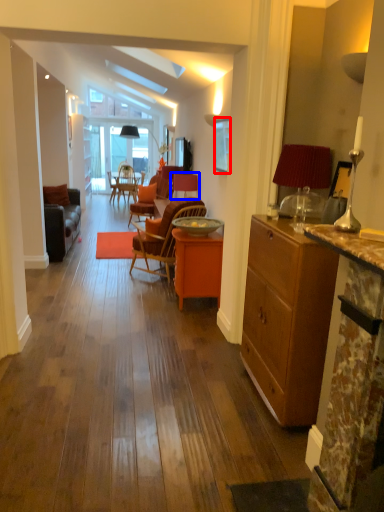
Question: Which object appears closest to the camera in this image, picture frame (highlighted by a red box) or chair (highlighted by a blue box)?

Choices:
 (A) picture frame
 (B) chair

Answer: (A)